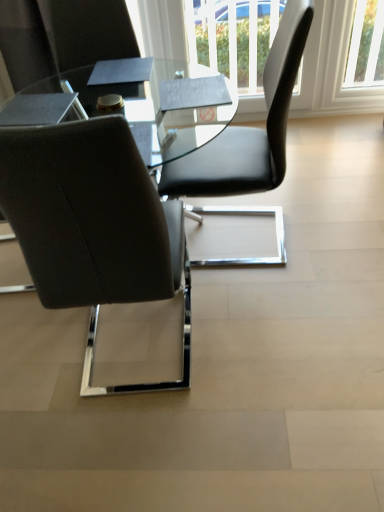
The image size is (384, 512). Identify the location of free space in front of black leather chair at upper right, acting as the 2th chair starting from the left. (280, 315).